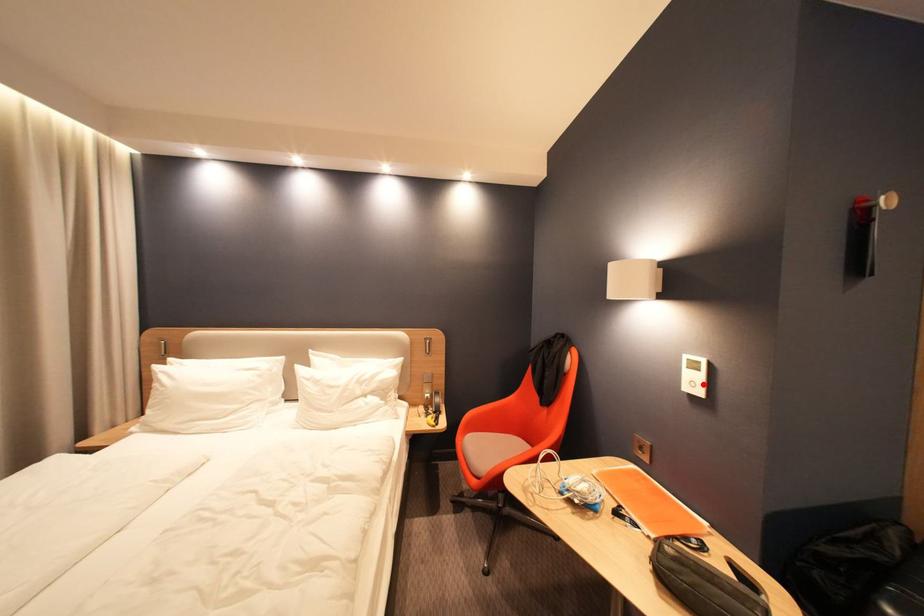
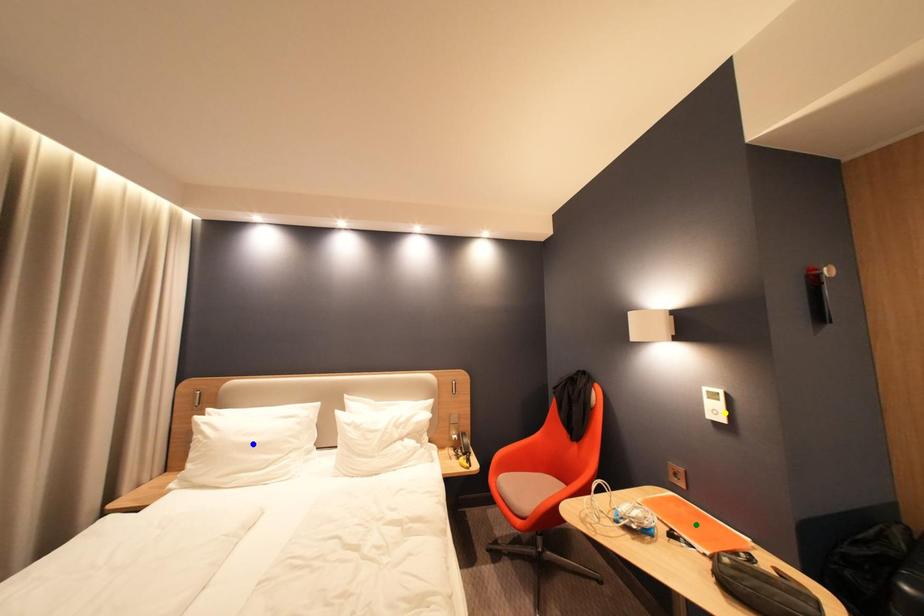
Question: I am providing you with two images of the same scene from different viewpoints. A red point is marked on the first image. You are given multiple points on the second image. In image 2, which mark is for the same physical point as the one in image 1?

Choices:
 (A) green point
 (B) blue point
 (C) yellow point

Answer: (C)